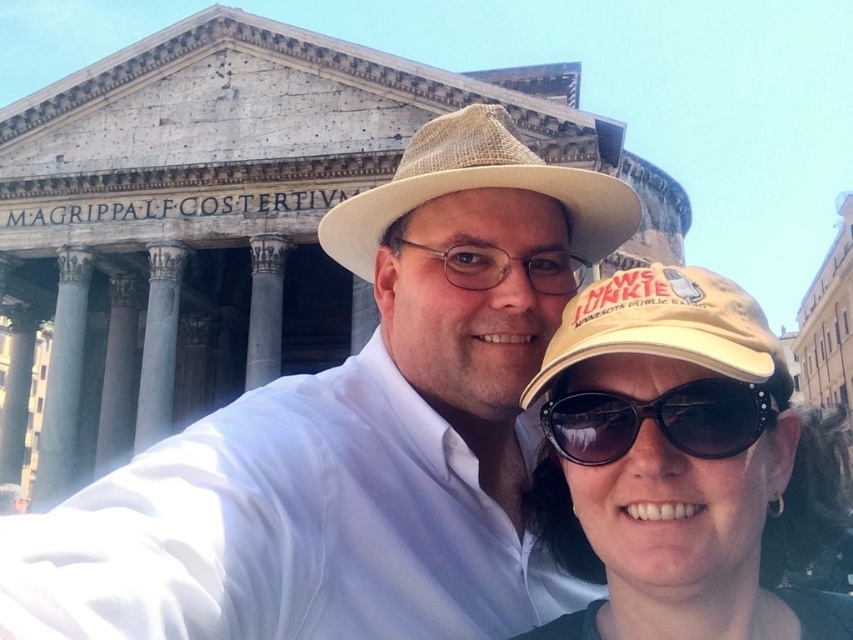
Question: Does white woven hat at center have a lesser width compared to yellow fabric cap at center?

Choices:
 (A) no
 (B) yes

Answer: (A)

Question: Which object is the farthest from the yellow fabric cap at lower right?

Choices:
 (A) beige straw hat at center
 (B) yellow fabric cap at center
 (C) black reflective sunglasses at lower center

Answer: (A)

Question: Can you confirm if yellow fabric cap at center is thinner than yellow fabric cap at lower right?

Choices:
 (A) no
 (B) yes

Answer: (A)

Question: Among these objects, which one is farthest from the camera?

Choices:
 (A) white woven hat at center
 (B) yellow fabric cap at center

Answer: (B)

Question: Can you confirm if white woven hat at center is positioned below yellow fabric cap at center?

Choices:
 (A) no
 (B) yes

Answer: (A)

Question: Which point is closer to the camera taking this photo?

Choices:
 (A) (341, 243)
 (B) (627, 428)

Answer: (B)